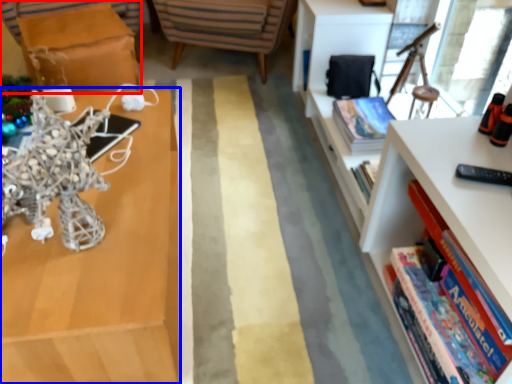
Question: Among these objects, which one is farthest to the camera, table (highlighted by a red box) or shelf (highlighted by a blue box)?

Choices:
 (A) table
 (B) shelf

Answer: (A)